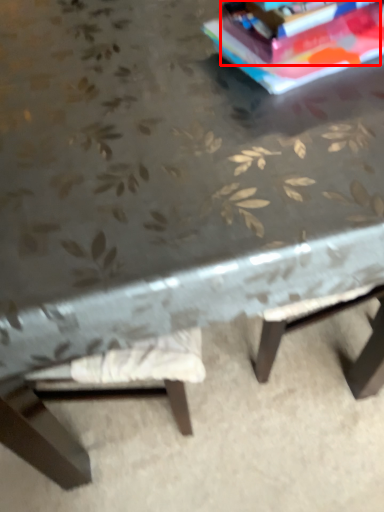
Question: From the image, what is the correct spatial relationship of paperback book (annotated by the red box) in relation to concrete?

Choices:
 (A) left
 (B) right

Answer: (B)